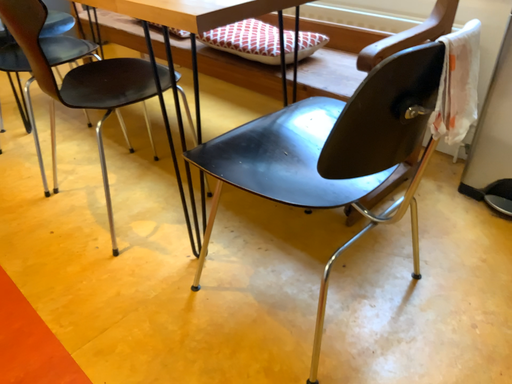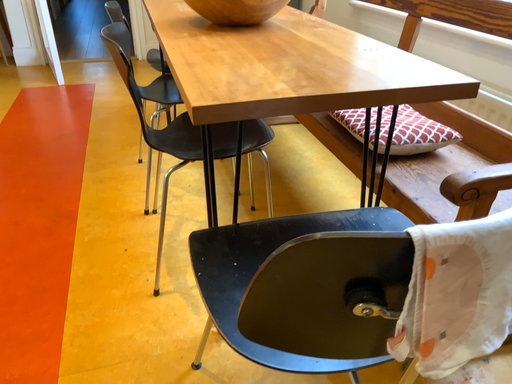
Question: How did the camera likely rotate when shooting the video?

Choices:
 (A) rotated left
 (B) rotated right

Answer: (A)